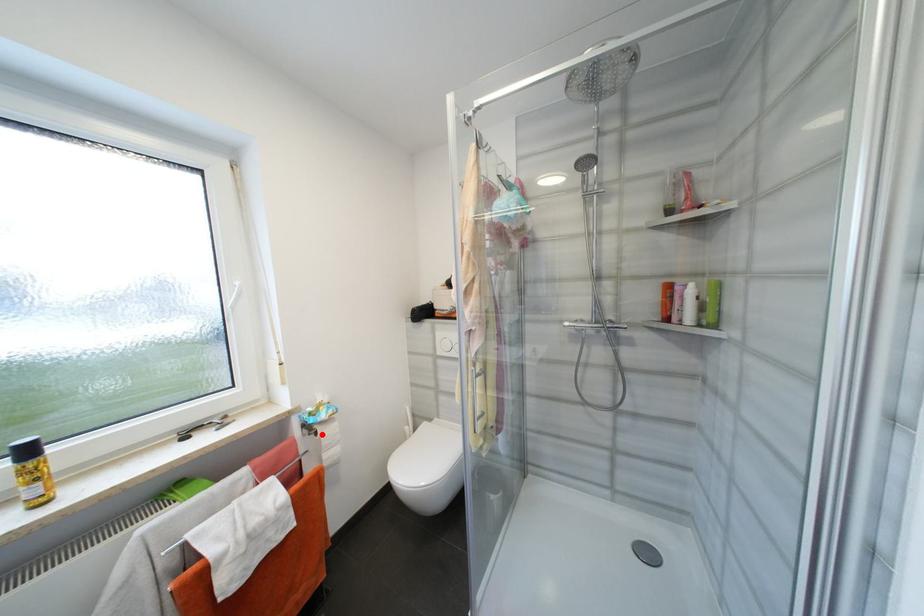
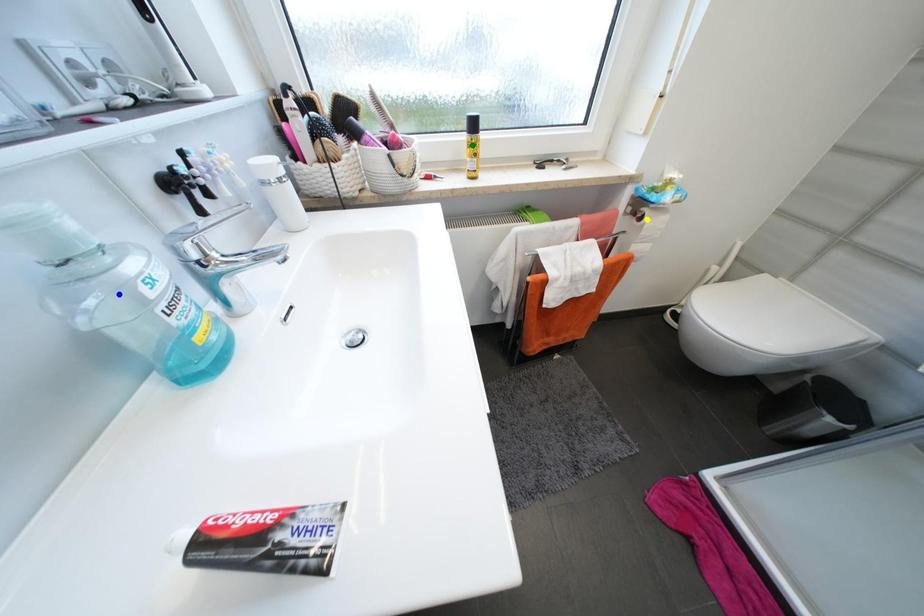
Question: I am providing you with two images of the same scene from different viewpoints. A red point is marked on the first image. You are given multiple points on the second image. Which mark in image 2 goes with the point in image 1?

Choices:
 (A) yellow point
 (B) green point
 (C) blue point

Answer: (A)